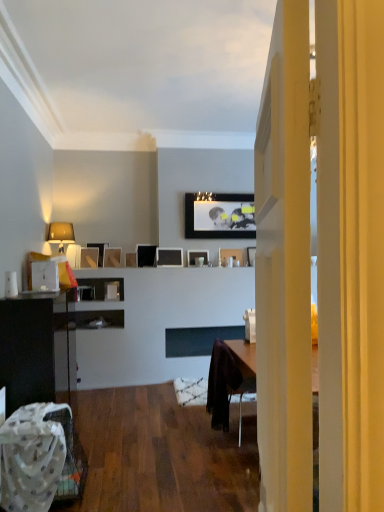
Identify the location of free space to the right of matte black cabinet at left. (119, 436).